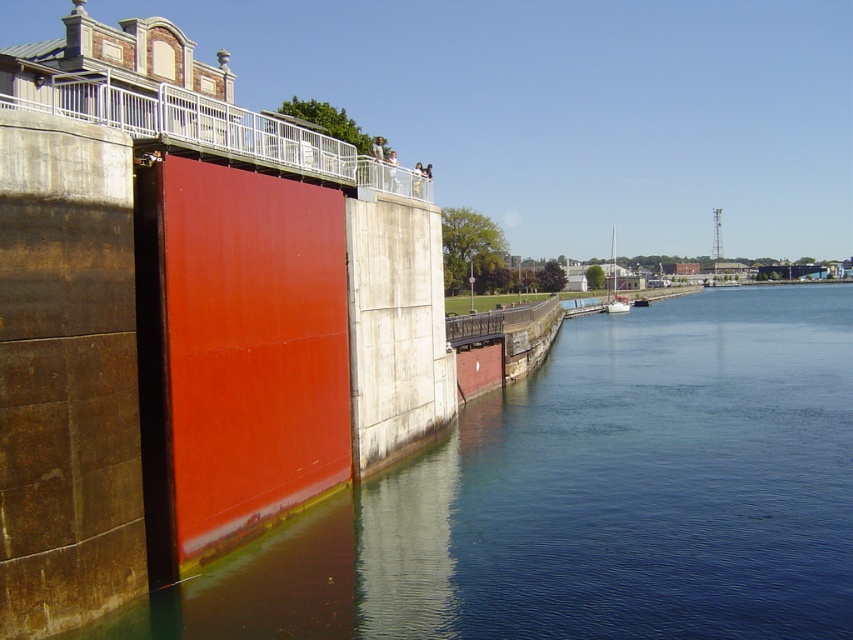
Is the position of smooth concrete wall at left less distant than that of white matte sailboat at center-right?

Yes, smooth concrete wall at left is closer to the viewer.

In the scene shown: Can you confirm if smooth concrete wall at left is positioned below white matte sailboat at center-right?

Yes.

Which is in front, point (740, 445) or point (613, 256)?

Point (740, 445)

Image resolution: width=853 pixels, height=640 pixels. I want to click on smooth concrete wall at left, so click(585, 497).